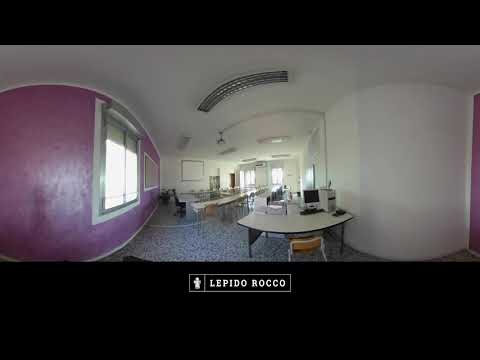
The image size is (480, 360). Identify the location of computer desk. (287, 224).